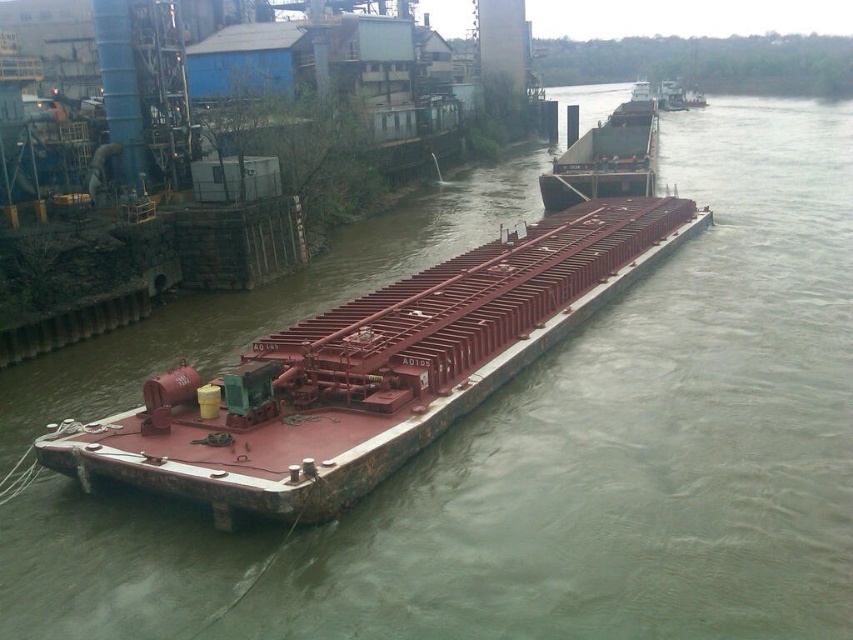
You are a crane operator trying to unload cargo from both the rusty metal barge at center and the rustic metal barge at center. Which barge should you start unloading first based on their positions?

You should start unloading the rusty metal barge at center first because it is positioned in front of the rustic metal barge at center, making it more accessible.

You are a crane operator tasked with loading cargo onto the rusty metal barge at center and the rustic metal barge at center. Given their widths, which barge can accommodate a wider cargo container?

The rustic metal barge at center has a greater width than the rusty metal barge at center, so it can accommodate a wider cargo container.